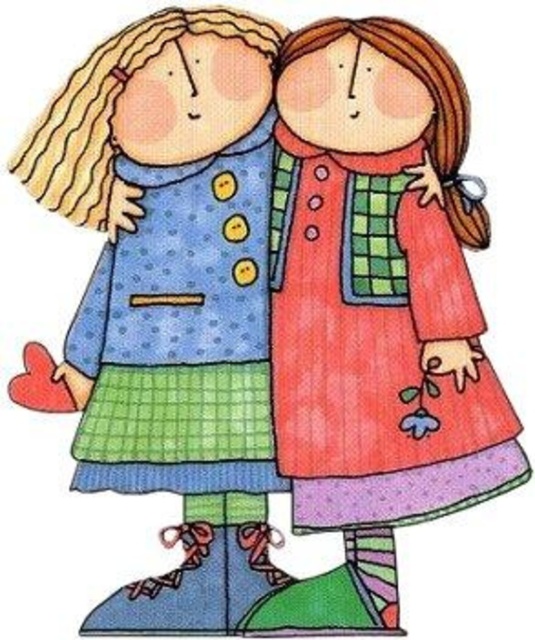
Does matte pink dress at right appear under matte blue dress at left?

Yes.

Does matte pink dress at right have a lesser height compared to matte blue dress at left?

Yes.

Between point (348, 532) and point (52, 115), which one is positioned in front?

Point (348, 532) is in front.

At what (x,y) coordinates should I click in order to perform the action: click on matte pink dress at right. Please return your answer as a coordinate pair (x, y). Looking at the image, I should click on (374, 314).